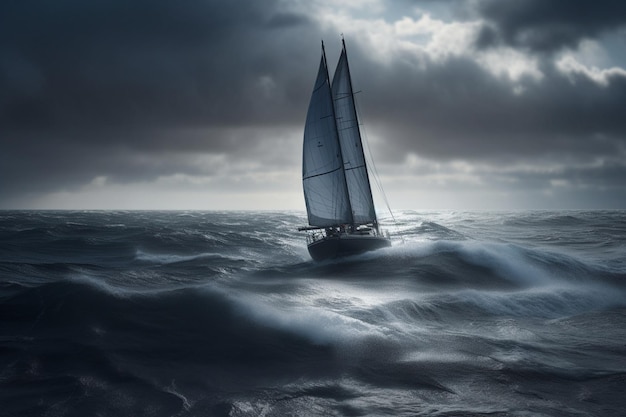
At what (x,y) coordinates should I click in order to perform the action: click on cables. Please return your answer as a coordinate pair (x, y). The height and width of the screenshot is (417, 626). Looking at the image, I should click on (366, 135), (374, 172), (399, 232).